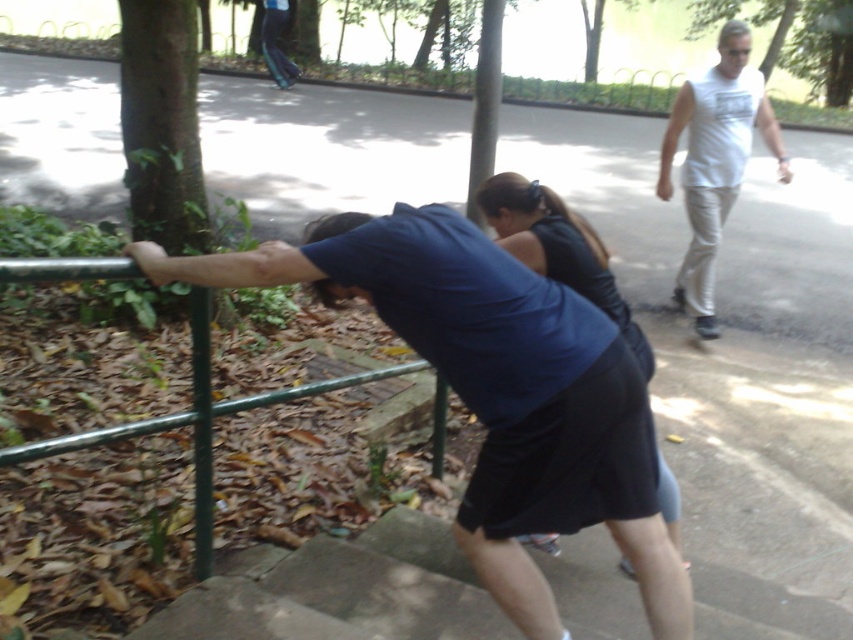
Question: Which of the following is the closest to the observer?

Choices:
 (A) green rough bark tree at upper left
 (B) green leafy tree at center
 (C) white cotton tank top at upper right
 (D) black fabric dress at center

Answer: (D)

Question: From the image, what is the correct spatial relationship of green rough bark tree at upper left in relation to white cotton tank top at upper right?

Choices:
 (A) right
 (B) left

Answer: (B)

Question: In this image, where is white cotton tank top at upper right located relative to black fabric dress at center?

Choices:
 (A) right
 (B) left

Answer: (A)

Question: Which object is positioned closest to the green rough bark tree at upper left?

Choices:
 (A) green leafy tree at center
 (B) white cotton tank top at upper right

Answer: (A)

Question: Which point is farther to the camera?

Choices:
 (A) green leafy tree at center
 (B) green rough bark tree at upper left

Answer: (A)

Question: Is green rough bark tree at upper left positioned in front of black fabric dress at center?

Choices:
 (A) yes
 (B) no

Answer: (B)